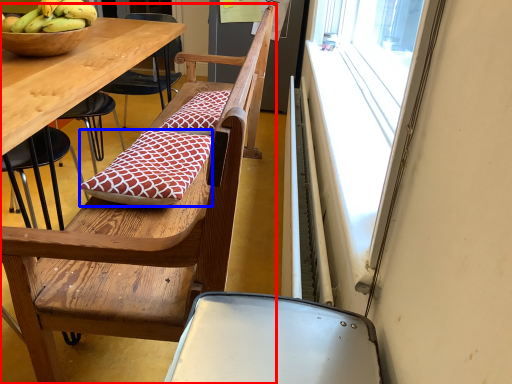
Question: Among these objects, which one is farthest to the camera, chair (highlighted by a red box) or pillow (highlighted by a blue box)?

Choices:
 (A) chair
 (B) pillow

Answer: (B)